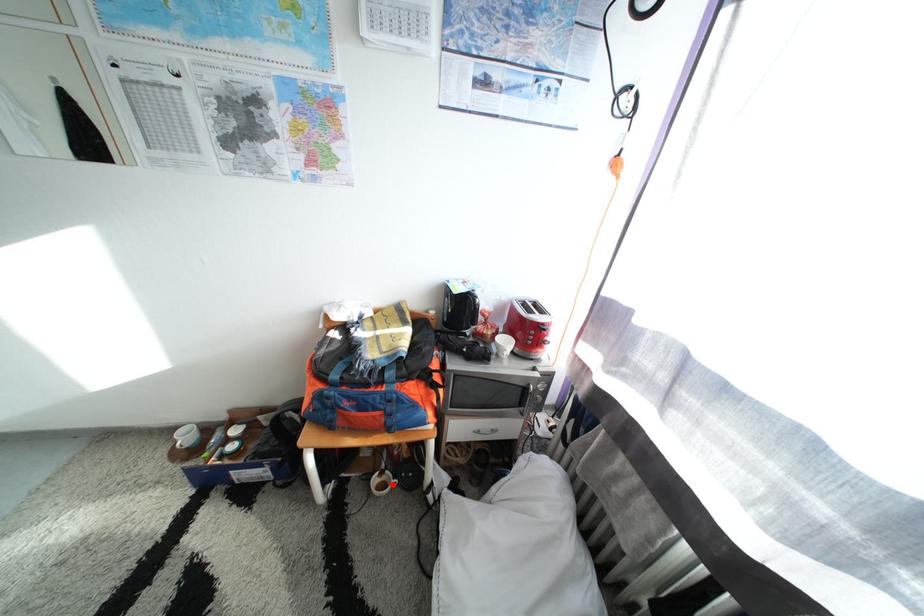
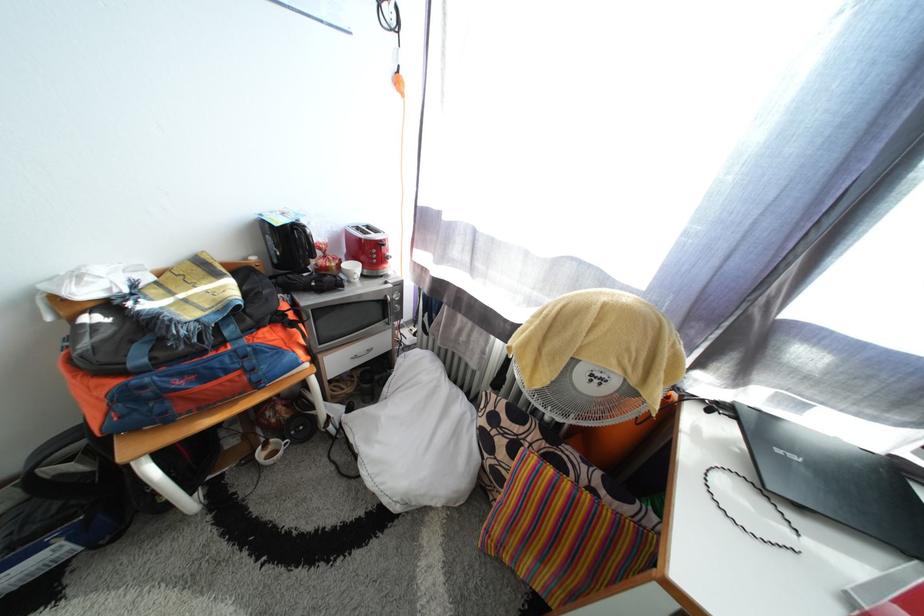
In the second image, find the point that corresponds to the highlighted location in the first image.

(280, 455)